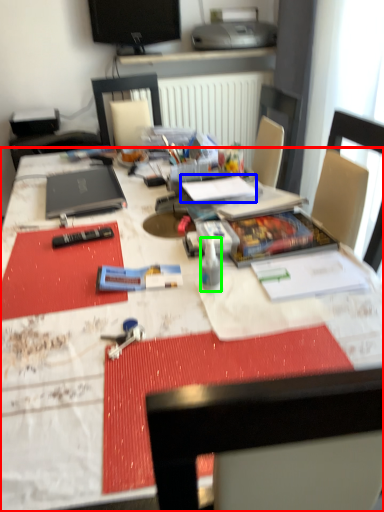
Question: Which is nearer to the desk (highlighted by a red box)? notebook (highlighted by a blue box) or bottle (highlighted by a green box).

Choices:
 (A) notebook
 (B) bottle

Answer: (B)